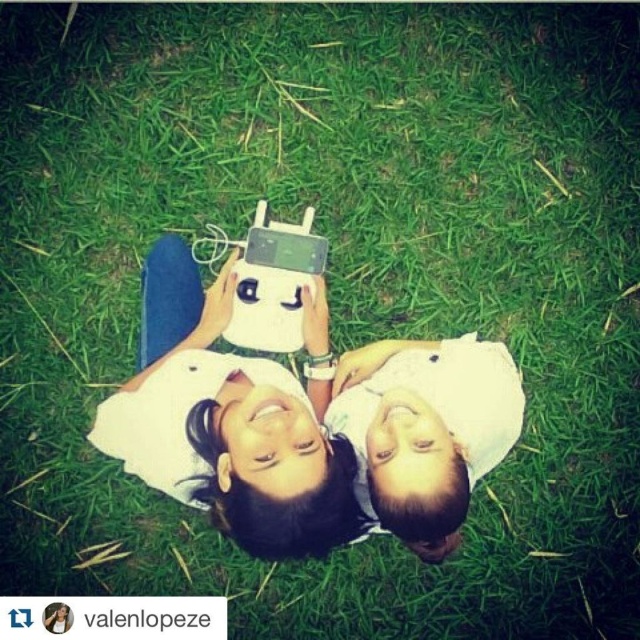
Who is more forward, (460, 464) or (364, 442)?

Point (460, 464) is more forward.

Consider the image. Is white matte phone at center bigger than white matte shirt at center?

Correct, white matte phone at center is larger in size than white matte shirt at center.

This screenshot has height=640, width=640. Find the location of `white matte phone at center`. white matte phone at center is located at coordinates (307, 424).

What are the coordinates of `white matte phone at center` in the screenshot? It's located at (307, 424).